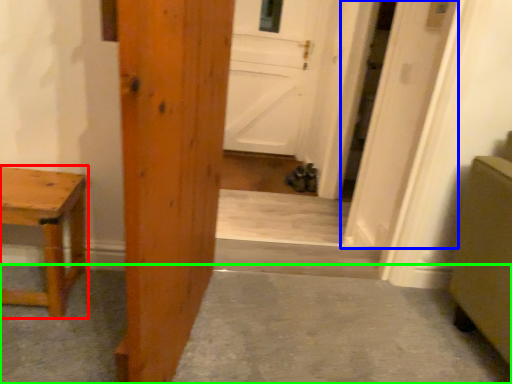
Question: Which is farther away from table (highlighted by a red box)? door (highlighted by a blue box) or concrete (highlighted by a green box)?

Choices:
 (A) door
 (B) concrete

Answer: (A)